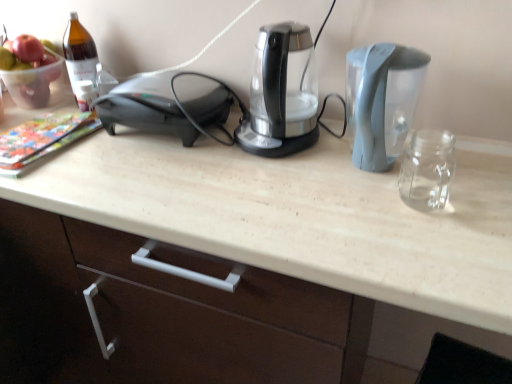
What do you see at coordinates (34, 85) in the screenshot?
I see `translucent glass bowl at upper left` at bounding box center [34, 85].

What is the approximate height of black plastic toaster at left?

black plastic toaster at left is 5.54 inches tall.

The width and height of the screenshot is (512, 384). Identify the location of translucent glass bowl at upper left. (34, 85).

Considering the sizes of objects transparent glass kettle at center, the first kitchen appliance viewed from the left, and translucent glass bowl at upper left in the image provided, who is thinner, transparent glass kettle at center, the first kitchen appliance viewed from the left, or translucent glass bowl at upper left?

With smaller width is translucent glass bowl at upper left.

Which point is more forward, (275,87) or (36,99)?

The point (275,87) is more forward.

From the image's perspective, is transparent glass kettle at center, which ranks as the 2th kitchen appliance in right-to-left order, below translucent glass bowl at upper left?

Indeed, from the image's perspective, transparent glass kettle at center, which ranks as the 2th kitchen appliance in right-to-left order, is shown beneath translucent glass bowl at upper left.

This screenshot has width=512, height=384. Find the location of `the 2nd kitchen appliance directly above the translucent glass bowl at upper left (from a real-world perspective)`. the 2nd kitchen appliance directly above the translucent glass bowl at upper left (from a real-world perspective) is located at coordinates (281, 93).

From a real-world perspective, is translucent glass bowl at upper left positioned above or below brown glass bottle at upper left?

In terms of real-world spatial position, translucent glass bowl at upper left is below brown glass bottle at upper left.

Would you consider translucent glass bowl at upper left to be distant from brown glass bottle at upper left?

translucent glass bowl at upper left is actually quite close to brown glass bottle at upper left.

From the image's perspective, between translucent glass bowl at upper left and brown glass bottle at upper left, who is located below?

brown glass bottle at upper left is shown below in the image.

Does brown glass bottle at upper left have a smaller size compared to transparent glass kettle at center, which ranks as the 2th kitchen appliance in right-to-left order?

Yes, brown glass bottle at upper left is smaller than transparent glass kettle at center, which ranks as the 2th kitchen appliance in right-to-left order.

From a real-world perspective, does brown glass bottle at upper left sit lower than transparent glass kettle at center, which ranks as the 2th kitchen appliance in right-to-left order?

Yes, from a real-world perspective, brown glass bottle at upper left is beneath transparent glass kettle at center, which ranks as the 2th kitchen appliance in right-to-left order.

Is the depth of brown glass bottle at upper left less than that of transparent glass kettle at center, the first kitchen appliance viewed from the left?

No, it is not.

From the image's perspective, relative to brown glass bottle at upper left, is gray plastic water at right, positioned as the 1th kitchen appliance in right-to-left order, above or below?

From the image's perspective, gray plastic water at right, positioned as the 1th kitchen appliance in right-to-left order, appears below brown glass bottle at upper left.

Is the position of gray plastic water at right, placed as the 2th kitchen appliance when sorted from left to right, more distant than that of brown glass bottle at upper left?

No, the depth of gray plastic water at right, placed as the 2th kitchen appliance when sorted from left to right, is less than that of brown glass bottle at upper left.

Is gray plastic water at right, positioned as the 1th kitchen appliance in right-to-left order, located outside brown glass bottle at upper left?

Yes, gray plastic water at right, positioned as the 1th kitchen appliance in right-to-left order, is located beyond the bounds of brown glass bottle at upper left.

Considering the sizes of objects gray plastic water at right, placed as the 2th kitchen appliance when sorted from left to right, and brown glass bottle at upper left in the image provided, who is taller, gray plastic water at right, placed as the 2th kitchen appliance when sorted from left to right, or brown glass bottle at upper left?

Standing taller between the two is brown glass bottle at upper left.

Is black plastic toaster at left smaller than gray plastic water at right, positioned as the 1th kitchen appliance in right-to-left order?

No, black plastic toaster at left is not smaller than gray plastic water at right, positioned as the 1th kitchen appliance in right-to-left order.

Does point (209, 99) appear closer or farther from the camera than point (382, 145)?

Point (209, 99) is farther from the camera than point (382, 145).

From a real-world perspective, which object stands above the other?

gray plastic water at right, positioned as the 1th kitchen appliance in right-to-left order, is physically above.

You are a GUI agent. You are given a task and a screenshot of the screen. Output one action in this format:
    pyautogui.click(x=<x>, y=<y>)
    Task: Click on the home appliance lying in front of the translucent glass bowl at upper left
    This screenshot has height=384, width=512.
    Given the screenshot: What is the action you would take?
    pyautogui.click(x=166, y=105)

Does translucent glass bowl at upper left have a greater height compared to black plastic toaster at left?

Indeed, translucent glass bowl at upper left has a greater height compared to black plastic toaster at left.

Consider the image. Which of these two, translucent glass bowl at upper left or black plastic toaster at left, is wider?

Wider between the two is black plastic toaster at left.

Is black plastic toaster at left surrounded by translucent glass bowl at upper left?

Definitely not — black plastic toaster at left is not inside translucent glass bowl at upper left.

Which is correct: transparent glass kettle at center, the first kitchen appliance viewed from the left, is inside black plastic toaster at left, or outside of it?

transparent glass kettle at center, the first kitchen appliance viewed from the left, exists outside the volume of black plastic toaster at left.

Considering the relative sizes of transparent glass kettle at center, which ranks as the 2th kitchen appliance in right-to-left order, and black plastic toaster at left in the image provided, is transparent glass kettle at center, which ranks as the 2th kitchen appliance in right-to-left order, taller than black plastic toaster at left?

Indeed, transparent glass kettle at center, which ranks as the 2th kitchen appliance in right-to-left order, has a greater height compared to black plastic toaster at left.

Is transparent glass kettle at center, the first kitchen appliance viewed from the left, turned away from black plastic toaster at left?

No.

From the image's perspective, is transparent glass kettle at center, which ranks as the 2th kitchen appliance in right-to-left order, on black plastic toaster at left?

Indeed, from the image's perspective, transparent glass kettle at center, which ranks as the 2th kitchen appliance in right-to-left order, is shown above black plastic toaster at left.

Find the location of a particular element. glass bowl on the left of transparent glass kettle at center, the first kitchen appliance viewed from the left is located at coordinates (34, 85).

This screenshot has width=512, height=384. I want to click on glass bowl that appears above the brown glass bottle at upper left (from the image's perspective), so click(34, 85).

Which object lies further to the anchor point transparent glass kettle at center, which ranks as the 2th kitchen appliance in right-to-left order, translucent glass bowl at upper left or black plastic toaster at left?

The object further to transparent glass kettle at center, which ranks as the 2th kitchen appliance in right-to-left order, is translucent glass bowl at upper left.

Considering their positions, is transparent glass kettle at center, which ranks as the 2th kitchen appliance in right-to-left order, positioned closer to translucent glass bowl at upper left than black plastic toaster at left?

Based on the image, black plastic toaster at left appears to be nearer to translucent glass bowl at upper left.

From the image, which object appears to be farther from black plastic toaster at left, transparent glass kettle at center, the first kitchen appliance viewed from the left, or translucent glass bowl at upper left?

The object further to black plastic toaster at left is translucent glass bowl at upper left.

When comparing their distances from transparent glass kettle at center, which ranks as the 2th kitchen appliance in right-to-left order, does gray plastic water at right, placed as the 2th kitchen appliance when sorted from left to right, or translucent glass bowl at upper left seem closer?

gray plastic water at right, placed as the 2th kitchen appliance when sorted from left to right, lies closer to transparent glass kettle at center, which ranks as the 2th kitchen appliance in right-to-left order, than the other object.

When comparing their distances from gray plastic water at right, positioned as the 1th kitchen appliance in right-to-left order, does translucent glass bowl at upper left or black plastic toaster at left seem further?

Based on the image, translucent glass bowl at upper left appears to be further to gray plastic water at right, positioned as the 1th kitchen appliance in right-to-left order.

Estimate the real-world distances between objects in this image. Which object is closer to gray plastic water at right, placed as the 2th kitchen appliance when sorted from left to right, black plastic toaster at left or transparent glass kettle at center, which ranks as the 2th kitchen appliance in right-to-left order?

Among the two, transparent glass kettle at center, which ranks as the 2th kitchen appliance in right-to-left order, is located nearer to gray plastic water at right, placed as the 2th kitchen appliance when sorted from left to right.

Estimate the real-world distances between objects in this image. Which object is closer to transparent glass kettle at center, the first kitchen appliance viewed from the left, brown glass bottle at upper left or black plastic toaster at left?

Among the two, black plastic toaster at left is located nearer to transparent glass kettle at center, the first kitchen appliance viewed from the left.

Estimate the real-world distances between objects in this image. Which object is further from gray plastic water at right, positioned as the 1th kitchen appliance in right-to-left order, black plastic toaster at left or brown glass bottle at upper left?

brown glass bottle at upper left lies further to gray plastic water at right, positioned as the 1th kitchen appliance in right-to-left order, than the other object.

Identify the location of home appliance located between brown glass bottle at upper left and gray plastic water at right, placed as the 2th kitchen appliance when sorted from left to right, in the left-right direction. (166, 105).

Find the location of a particular element. kitchen appliance located between black plastic toaster at left and gray plastic water at right, placed as the 2th kitchen appliance when sorted from left to right, in the left-right direction is located at coordinates (281, 93).

The image size is (512, 384). What are the coordinates of `wine bottle situated between translucent glass bowl at upper left and transparent glass kettle at center, which ranks as the 2th kitchen appliance in right-to-left order, from left to right` in the screenshot? It's located at (79, 52).

I want to click on home appliance between translucent glass bowl at upper left and gray plastic water at right, placed as the 2th kitchen appliance when sorted from left to right, from left to right, so click(x=166, y=105).